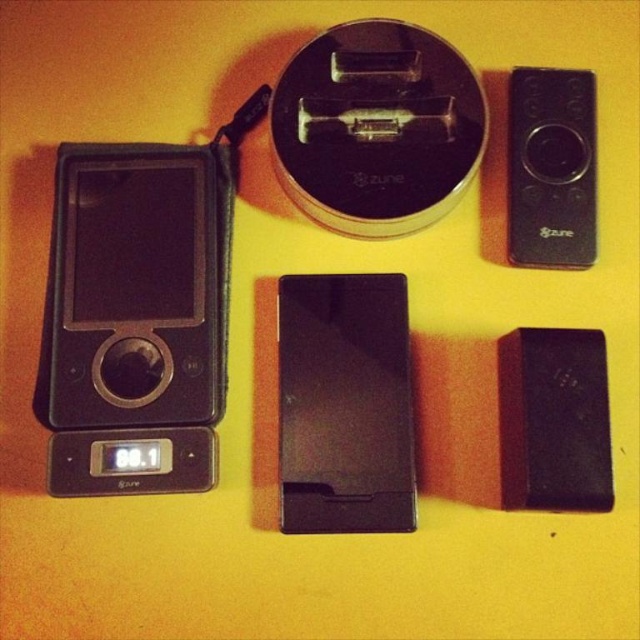
You are setting up a display for a tech exhibition and need to place the matte black ipod at left and the black matte remote control at upper right on a shelf. The shelf has a width of 15 cm. Can both items fit side by side without overlapping?

The matte black ipod at left might be wider than the black matte remote control at upper right, so there is uncertainty about whether they can fit side by side on a 15 cm shelf. Measure their actual widths to confirm.

You are organizing a display of vintage electronics on a shelf. You have a black matte ipod at center and a black matte remote control at upper right. Which object should you place first if you want to ensure the taller item is positioned at the back for visibility?

The black matte ipod at center is taller than the black matte remote control at upper right, so you should place the black matte ipod at center first at the back to ensure visibility.

Looking at this image, you are standing in front of the vintage electronic devices displayed on the bright yellow surface. You see a point marked at coordinates (138, 285). Which object is this point located on?

The point at coordinates (138, 285) is on the matte black ipod at left.